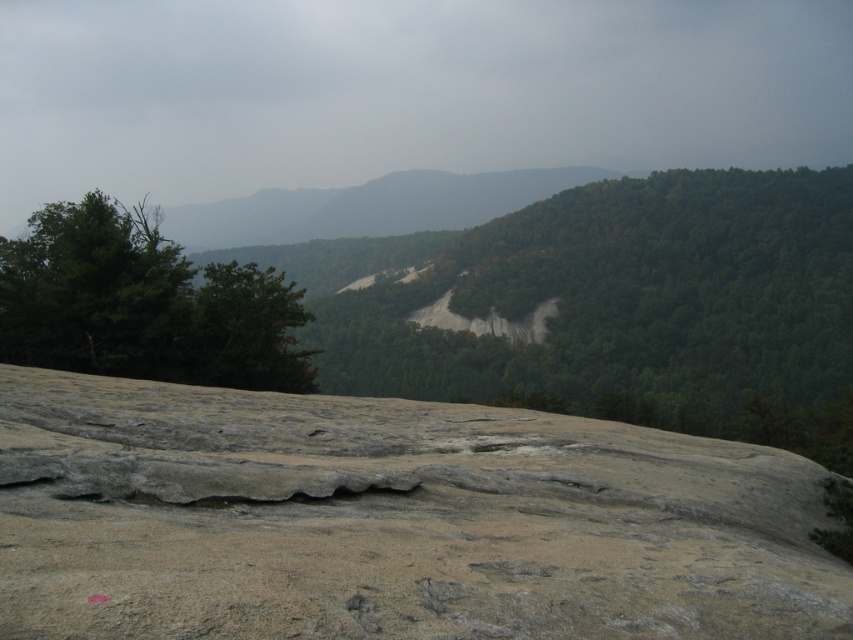
Question: Which of the following is the farthest from the observer?

Choices:
 (A) green leafy tree at center
 (B) green leafy tree at left

Answer: (B)

Question: Is green leafy tree at center positioned at the back of green leafy tree at left?

Choices:
 (A) no
 (B) yes

Answer: (A)

Question: Observing the image, what is the correct spatial positioning of green leafy tree at center in reference to green leafy tree at left?

Choices:
 (A) below
 (B) above

Answer: (A)

Question: Can you confirm if green leafy tree at center is positioned to the right of green leafy tree at left?

Choices:
 (A) yes
 (B) no

Answer: (A)

Question: Which point is farther to the camera?

Choices:
 (A) (321, 328)
 (B) (178, 260)

Answer: (A)